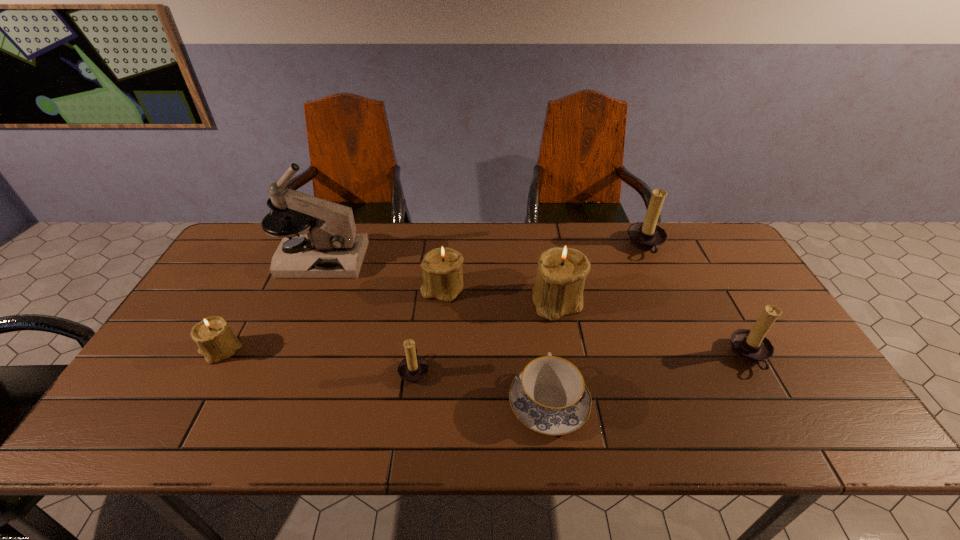
Locate an element on the screen. The image size is (960, 540). microscope is located at coordinates (330, 248).

Identify the location of the second candle holder from right to left. (647, 236).

Find the location of `the seventh object from left to right`. the seventh object from left to right is located at coordinates (647, 236).

Identify the location of the third candle holder from right to left. (558, 290).

At what (x,y) coordinates should I click in order to perform the action: click on the rightmost beige candle_holder. Please return your answer as a coordinate pair (x, y). This screenshot has width=960, height=540. Looking at the image, I should click on (558, 290).

This screenshot has height=540, width=960. I want to click on the second biggest beige candle_holder, so click(x=442, y=274).

You are a GUI agent. You are given a task and a screenshot of the screen. Output one action in this format:
    pyautogui.click(x=<x>, y=<y>)
    Task: Click on the rightmost object
    This screenshot has width=960, height=540.
    Given the screenshot: What is the action you would take?
    pyautogui.click(x=751, y=346)

Where is `the second biggest brown candle holder`? This screenshot has height=540, width=960. the second biggest brown candle holder is located at coordinates (751, 346).

This screenshot has width=960, height=540. Identify the location of the smallest beige candle_holder. (216, 341).

This screenshot has height=540, width=960. Find the location of `the leftmost beige candle_holder`. the leftmost beige candle_holder is located at coordinates (216, 341).